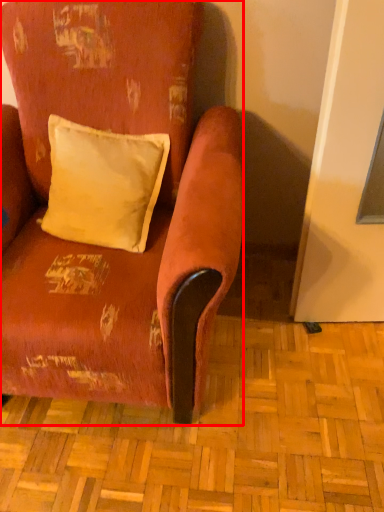
Question: From the image's perspective, what is the correct spatial positioning of chair (annotated by the red box) in reference to pillow?

Choices:
 (A) above
 (B) below

Answer: (B)